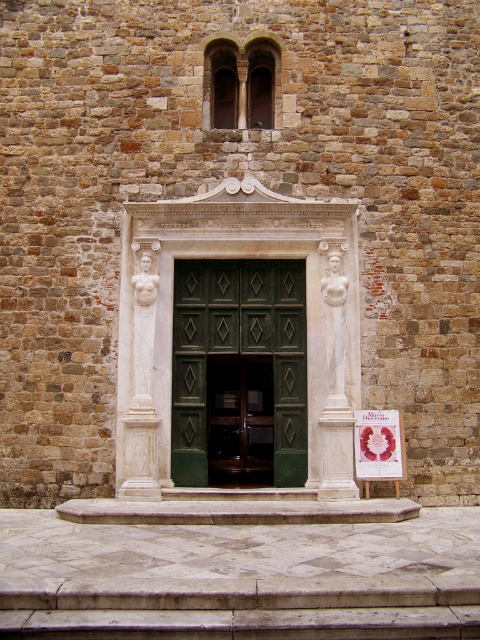
You are standing at the entrance of the historic building described. There is a point marked at coordinates (239, 356). What object is located at that point?

The green wooden door at center is located at point (239, 356).

You are a delivery person trying to bring a large package through the entrance. The package is 1.8 meters wide. The green wooden door at center and white marble statue at center are both in your path. Based on their widths, can you determine if the package will fit through the doorway?

The green wooden door at center might be wider than white marble statue at center. Since the package is 1.8 meters wide, if the door is indeed wider than the statue, it is possible that the door could accommodate the package. However, without exact measurements, it is uncertain. You should measure the door width before attempting to bring the package through.

You are standing at the entrance of the historic building and want to locate the green wooden door at center. Based on the coordinates provided, where should you look relative to the center of the image?

The green wooden door at center is located at coordinates approximately 0.559 on the x and 0.498 on the y axis, which places it slightly to the right and just below the exact center of the image.